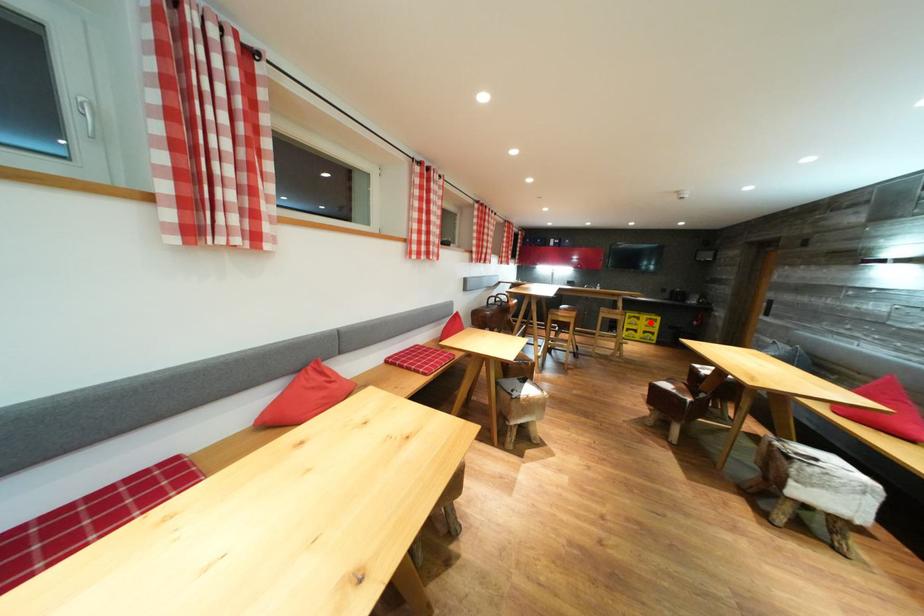
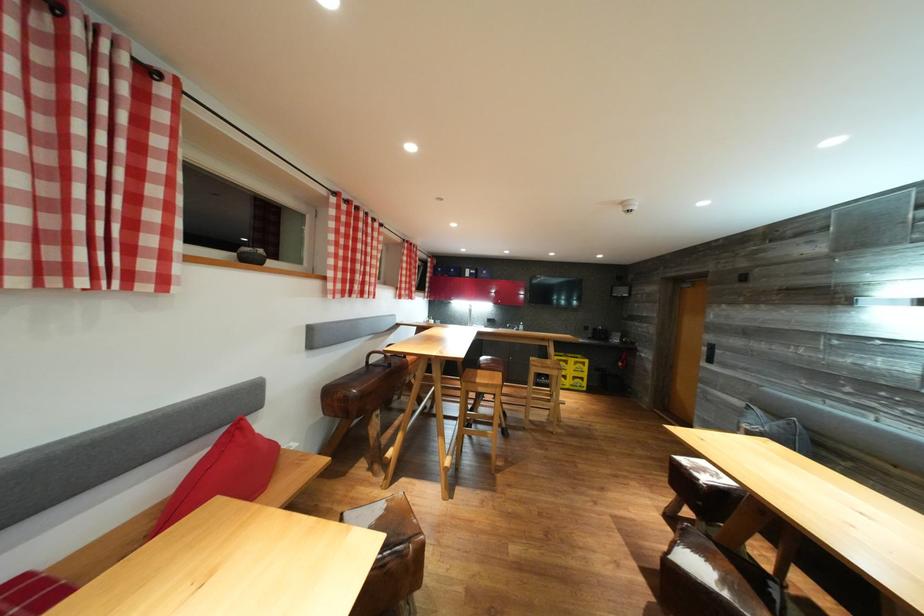
Question: I am providing you with two images of the same scene from different viewpoints. In image1, a red point is highlighted. Considering the same 3D point in image2, which of the following is correct?

Choices:
 (A) It is closer
 (B) It is farther

Answer: (B)